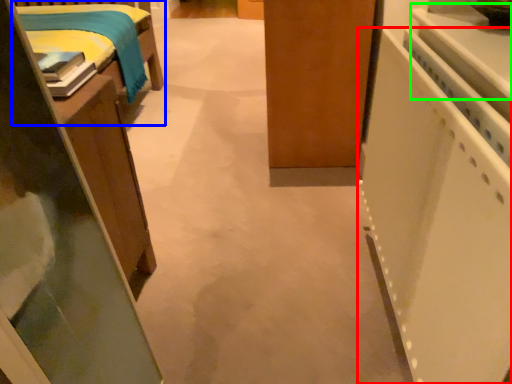
Question: Considering the real-world distances, which object is farthest from appliance (highlighted by a red box)? furniture (highlighted by a blue box) or counter top (highlighted by a green box)?

Choices:
 (A) furniture
 (B) counter top

Answer: (A)